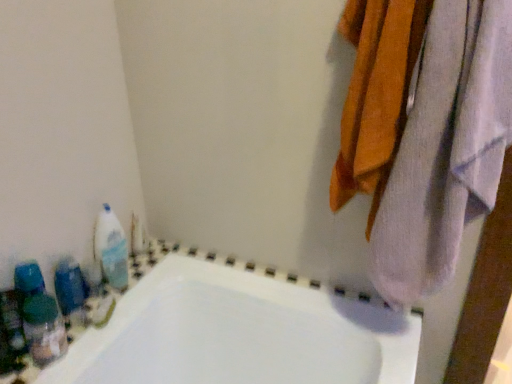
Question: Is white soft towel at upper right situated inside white glossy bottle at left, placed as the first cleaning product when sorted from top to bottom, or outside?

Choices:
 (A) outside
 (B) inside

Answer: (A)

Question: Is white soft towel at upper right taller or shorter than white glossy bottle at left, placed as the first cleaning product when sorted from top to bottom?

Choices:
 (A) short
 (B) tall

Answer: (B)

Question: Estimate the real-world distances between objects in this image. Which object is closer to the blue plastic bottles at left?

Choices:
 (A) white glossy bottle at left, the 2th cleaning product positioned from the bottom
 (B) translucent plastic bottles at left, arranged as the first cleaning product when viewed from the front
 (C) white soft towel at upper right

Answer: (B)

Question: Estimate the real-world distances between objects in this image. Which object is farther from the blue plastic bottles at left?

Choices:
 (A) translucent plastic bottles at left, which ranks as the first cleaning product in bottom-to-top order
 (B) white glossy bottle at left, placed as the first cleaning product when sorted from top to bottom
 (C) white soft towel at upper right

Answer: (C)